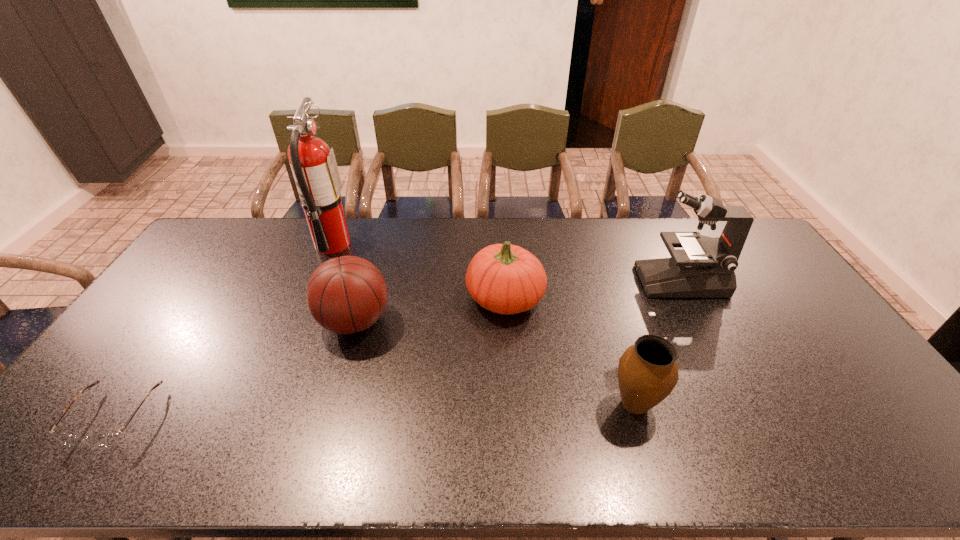
Locate an element on the screen. The image size is (960, 540). fire extinguisher is located at coordinates (313, 164).

The width and height of the screenshot is (960, 540). In order to click on the fifth shortest object in this screenshot , I will do `click(705, 267)`.

The height and width of the screenshot is (540, 960). What are the coordinates of `microscope` in the screenshot? It's located at (705, 267).

Identify the location of basketball. Image resolution: width=960 pixels, height=540 pixels. (347, 294).

Locate an element on the screen. the fourth object from left to right is located at coordinates (506, 279).

Where is `urn`? urn is located at coordinates (648, 372).

Find the location of a particular element. The image size is (960, 540). the leftmost object is located at coordinates (108, 440).

This screenshot has width=960, height=540. I want to click on spectacles, so click(x=108, y=440).

What are the coordinates of `free location located 0.250m on the nozzle side of the fire extinguisher` in the screenshot? It's located at (419, 244).

At what (x,y) coordinates should I click in order to perform the action: click on vacant space positioned through the eyepieces of the microscope. Please return your answer as a coordinate pair (x, y). The width and height of the screenshot is (960, 540). Looking at the image, I should click on (565, 280).